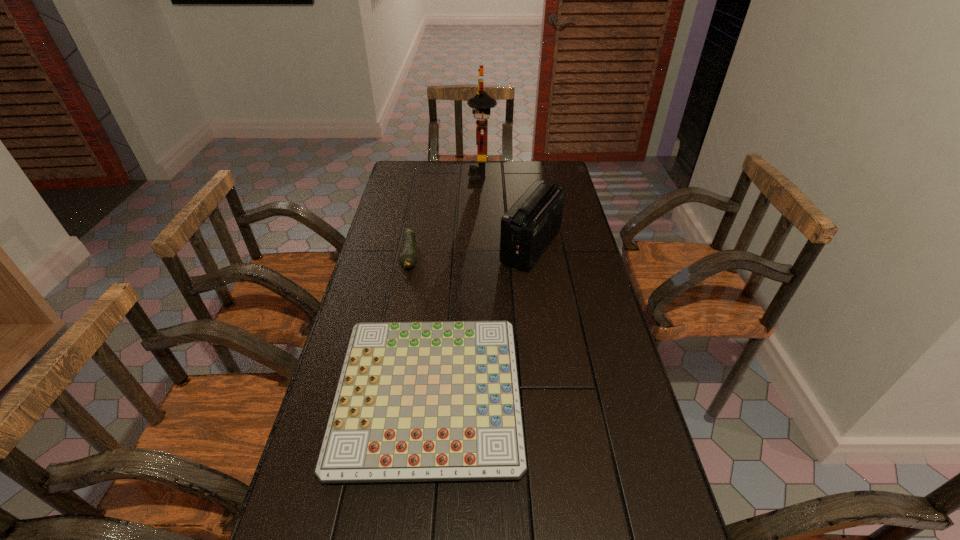
Locate an element on the screen. This screenshot has width=960, height=540. vacant space situated on the front panel of the third shortest object is located at coordinates (428, 246).

What are the coordinates of `free location located at the blossom end of the zucchini` in the screenshot? It's located at (388, 376).

Where is `free spot located 0.220m on the back of the nearest object`? free spot located 0.220m on the back of the nearest object is located at coordinates [441, 278].

I want to click on object at the far edge, so click(x=482, y=102).

You are a GUI agent. You are given a task and a screenshot of the screen. Output one action in this format:
    pyautogui.click(x=<x>, y=<y>)
    Task: Click on the zucchini that is at the left edge
    
    Given the screenshot: What is the action you would take?
    pyautogui.click(x=407, y=260)

Find the location of a particular element. gameboard that is at the left edge is located at coordinates (416, 401).

Locate an element on the screen. object that is at the right edge is located at coordinates (528, 227).

Locate an element on the screen. Image resolution: width=960 pixels, height=540 pixels. free space at the far edge is located at coordinates (459, 166).

In the image, there is a desktop. Identify the location of free space at the left edge. (386, 234).

Find the location of a particular element. The image size is (960, 540). free space at the right edge of the desktop is located at coordinates tap(566, 192).